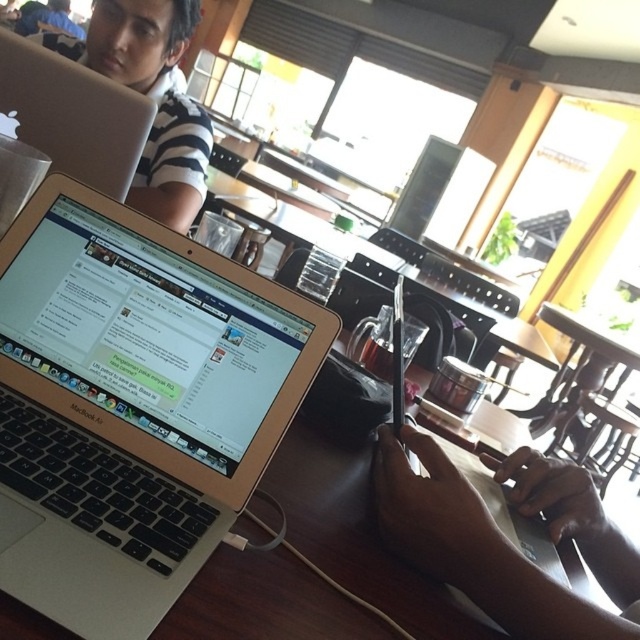
Question: Can you confirm if silver metallic laptop at center is positioned below smooth skin hands at center?

Choices:
 (A) yes
 (B) no

Answer: (B)

Question: Which point is farther to the camera?

Choices:
 (A) smooth skin hands at center
 (B) silver metallic laptop at upper left
 (C) silver metallic laptop at center

Answer: (B)

Question: Observing the image, what is the correct spatial positioning of silver metallic laptop at center in reference to wooden table at center?

Choices:
 (A) right
 (B) left

Answer: (B)

Question: Is smooth skin hands at center wider than silver metallic laptop at upper left?

Choices:
 (A) no
 (B) yes

Answer: (B)

Question: Which object appears closest to the camera in this image?

Choices:
 (A) wooden table at center
 (B) silver metallic laptop at center

Answer: (A)

Question: Which of these objects is positioned farthest from the silver metallic laptop at center?

Choices:
 (A) smooth skin hands at center
 (B) silver metallic laptop at upper left

Answer: (B)